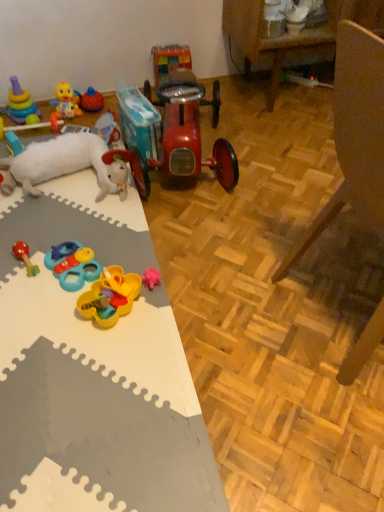
Identify the location of free space in front of yellow plastic toy at center, positioned as the 9th toy in left-to-right order. (109, 354).